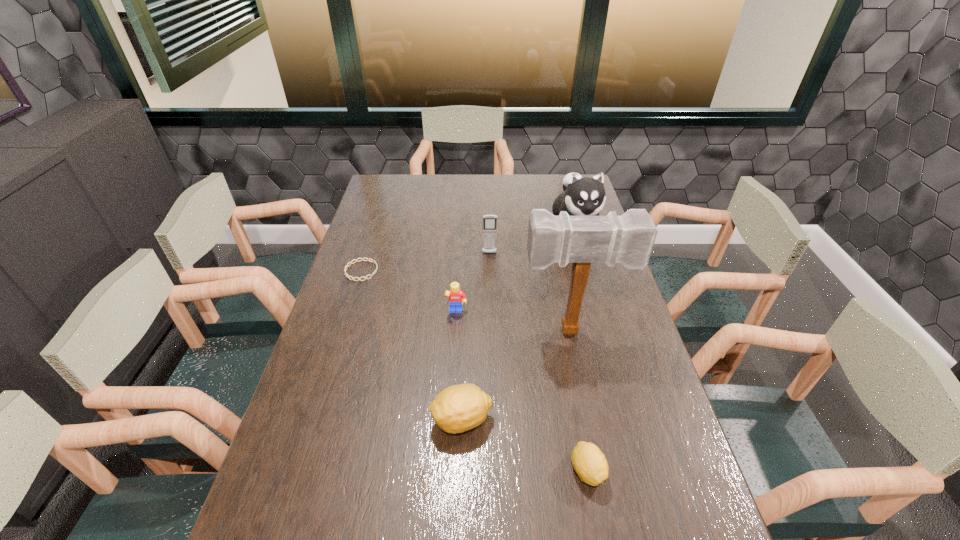
Where is `vacant space at the near left corner of the desktop`? This screenshot has width=960, height=540. vacant space at the near left corner of the desktop is located at coordinates (287, 534).

Locate an element on the screen. The height and width of the screenshot is (540, 960). vacant space at the far right corner of the desktop is located at coordinates (558, 189).

Image resolution: width=960 pixels, height=540 pixels. Identify the location of blank region between the shorter lemon and the fifth shortest object. (539, 362).

Locate an element on the screen. This screenshot has width=960, height=540. vacant space that's between the farther lemon and the second shortest object is located at coordinates (524, 445).

This screenshot has height=540, width=960. I want to click on empty space that is in between the farther lemon and the second tallest object, so coord(518,322).

This screenshot has width=960, height=540. I want to click on vacant point located between the nearest object and the fifth shortest object, so click(x=539, y=362).

At what (x,y) coordinates should I click in order to perform the action: click on unoccupied position between the taller lemon and the fifth shortest object. Please return your answer as a coordinate pair (x, y). Looking at the image, I should click on (476, 336).

Locate an element on the screen. free spot between the nearer lemon and the third nearest object is located at coordinates click(x=579, y=401).

This screenshot has height=540, width=960. I want to click on free space between the shortest object and the left lemon, so click(x=412, y=346).

The image size is (960, 540). I want to click on vacant space in between the second tallest object and the nearer lemon, so coord(581,348).